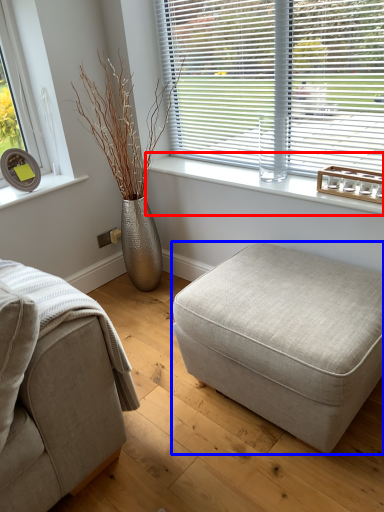
Question: Which object is further to the camera taking this photo, window sill (highlighted by a red box) or stool (highlighted by a blue box)?

Choices:
 (A) window sill
 (B) stool

Answer: (A)